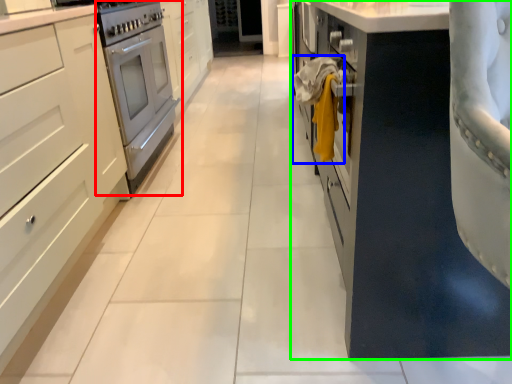
Question: Which is nearer to the home appliance (highlighted by a red box)? laundry (highlighted by a blue box) or cabinetry (highlighted by a green box).

Choices:
 (A) laundry
 (B) cabinetry

Answer: (A)